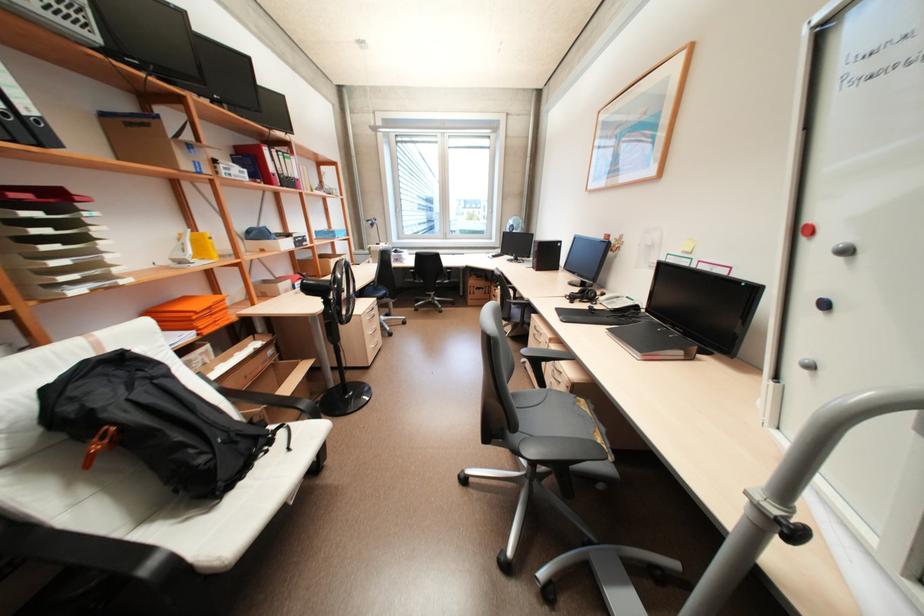
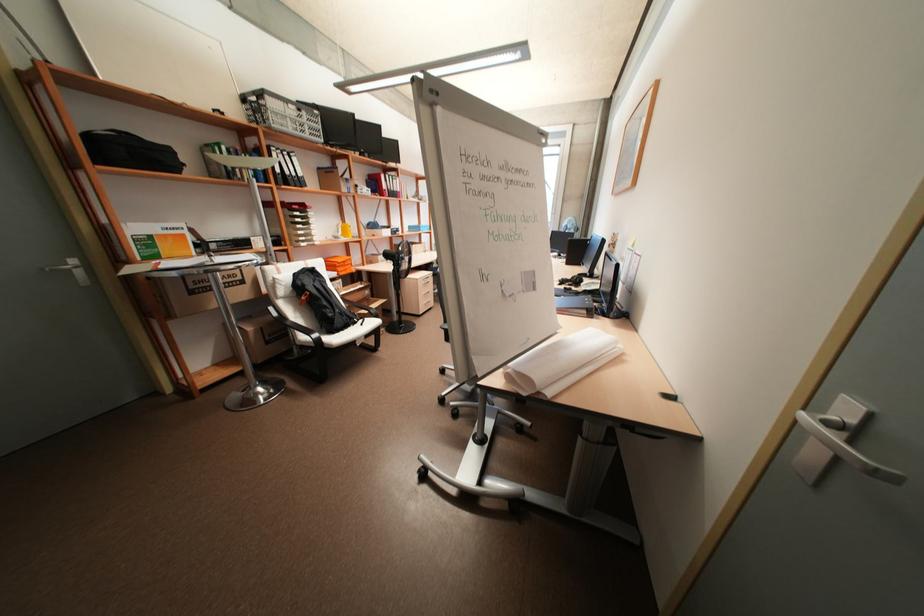
The point at (136, 387) is marked in the first image. Where is the corresponding point in the second image?

(320, 281)